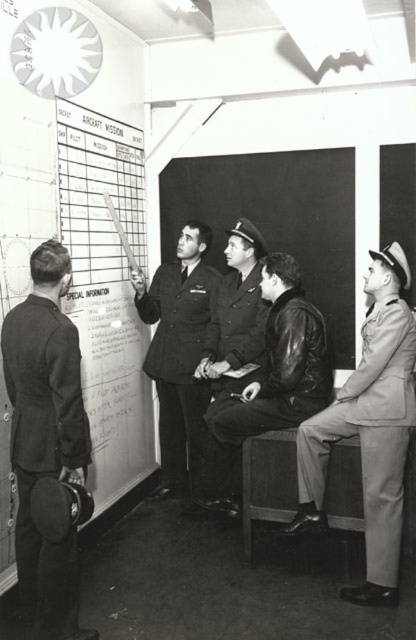
From the picture: Does dark suit at left have a greater height compared to uniformed officer at center?

No, dark suit at left is not taller than uniformed officer at center.

Is point (12, 358) less distant than point (192, 492)?

Yes, it is in front of point (192, 492).

Find the location of `dark suit at left`. dark suit at left is located at coordinates (46, 436).

Who is more distant from viewer, (83, 120) or (388, 566)?

Point (83, 120)

Is point (59, 156) in front of point (383, 300)?

No, (59, 156) is further to viewer.

The image size is (416, 640). I want to click on white paperboard at left, so pyautogui.click(x=106, y=289).

Who is higher up, light gray fabric jacket at right or dark blue leather jacket at center?

dark blue leather jacket at center is above.

At what (x,y) coordinates should I click in order to perform the action: click on light gray fabric jacket at right. Please return your answer as a coordinate pair (x, y). The height and width of the screenshot is (640, 416). Looking at the image, I should click on (369, 433).